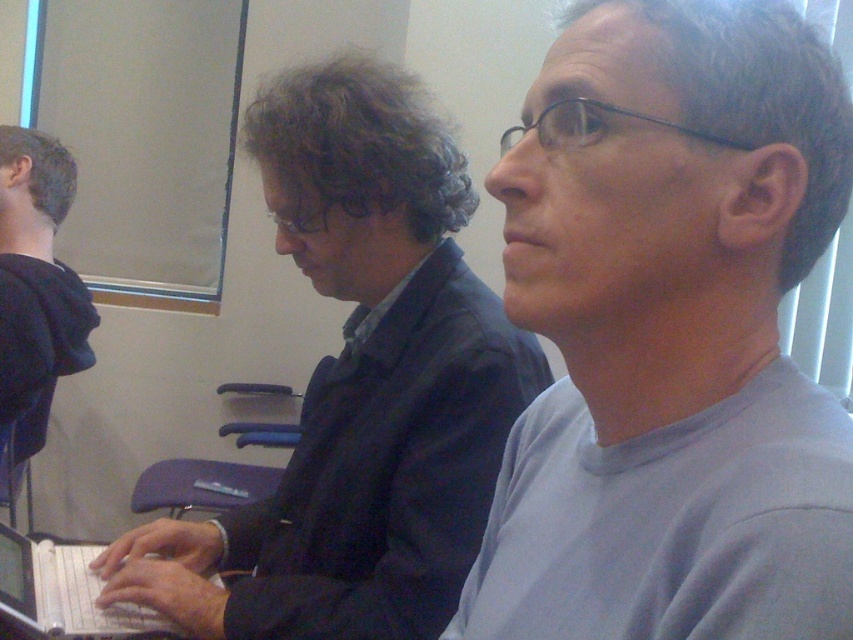
Who is more distant from viewer, (x=444, y=296) or (x=22, y=596)?

The point (x=444, y=296) is more distant.

Is point (314, 436) positioned in front of point (4, 596)?

That is False.

Identify the location of dark blue suit at center. (358, 385).

Measure the distance between gray matte shirt at center and camera.

gray matte shirt at center is 39.97 centimeters from camera.

Who is more distant from viewer, (631,529) or (93,580)?

Point (93,580)

The width and height of the screenshot is (853, 640). What are the coordinates of `gray matte shirt at center` in the screenshot? It's located at (670, 333).

Between point (346, 324) and point (71, 291), which one is positioned in front?

Point (346, 324) is more forward.

Locate an element on the screen. This screenshot has width=853, height=640. dark blue suit at center is located at coordinates (358, 385).

What are the coordinates of `dark blue suit at center` in the screenshot? It's located at 358,385.